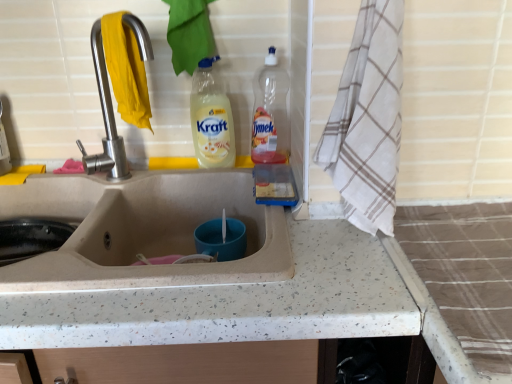
Question: Is satin nickel faucet at upper left touching speckled stone countertop at center?

Choices:
 (A) yes
 (B) no

Answer: (B)

Question: Considering the relative sizes of satin nickel faucet at upper left and speckled stone countertop at center in the image provided, is satin nickel faucet at upper left shorter than speckled stone countertop at center?

Choices:
 (A) no
 (B) yes

Answer: (B)

Question: Could you tell me if satin nickel faucet at upper left is turned towards speckled stone countertop at center?

Choices:
 (A) no
 (B) yes

Answer: (A)

Question: Can you confirm if satin nickel faucet at upper left is taller than speckled stone countertop at center?

Choices:
 (A) yes
 (B) no

Answer: (B)

Question: From the image's perspective, is satin nickel faucet at upper left located above speckled stone countertop at center?

Choices:
 (A) yes
 (B) no

Answer: (A)

Question: Does satin nickel faucet at upper left have a larger size compared to speckled stone countertop at center?

Choices:
 (A) no
 (B) yes

Answer: (A)

Question: Is the surface of white checkered towel at right in direct contact with speckled stone countertop at center?

Choices:
 (A) yes
 (B) no

Answer: (B)

Question: Is white checkered towel at right positioned beyond the bounds of speckled stone countertop at center?

Choices:
 (A) yes
 (B) no

Answer: (A)

Question: Is white checkered towel at right wider than speckled stone countertop at center?

Choices:
 (A) no
 (B) yes

Answer: (A)

Question: Considering the relative positions of white checkered towel at right and speckled stone countertop at center in the image provided, is white checkered towel at right to the left of speckled stone countertop at center from the viewer's perspective?

Choices:
 (A) no
 (B) yes

Answer: (A)

Question: Can you confirm if white checkered towel at right is taller than speckled stone countertop at center?

Choices:
 (A) yes
 (B) no

Answer: (B)

Question: Does white checkered towel at right lie behind speckled stone countertop at center?

Choices:
 (A) yes
 (B) no

Answer: (A)

Question: From the image's perspective, is white checkered towel at right over translucent plastic bottle at upper right, placed as the first bottle when sorted from right to left?

Choices:
 (A) yes
 (B) no

Answer: (B)